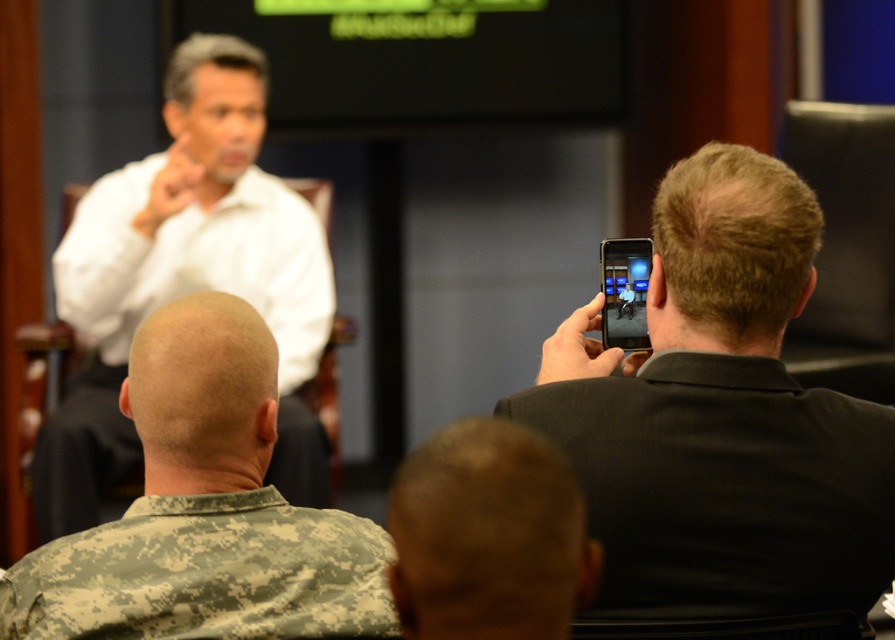
Is point (194, 538) more distant than point (483, 442)?

Yes, point (194, 538) is farther from viewer.

Is point (164, 497) positioned before point (559, 490)?

No, (164, 497) is further to viewer.

The image size is (895, 640). I want to click on camouflage fabric at lower left, so click(x=206, y=573).

From the picture: Between dark gray suit at upper right and white matte shirt at upper center, which one has less height?

With less height is dark gray suit at upper right.

Between point (820, 417) and point (229, 132), which one is positioned behind?

The point (229, 132) is behind.

Identify the location of dark gray suit at upper right. This screenshot has width=895, height=640. (720, 417).

Which of these two, camouflage uniform at lower left or camouflage uniform at lower center, stands taller?

camouflage uniform at lower left is taller.

Looking at this image, does camouflage uniform at lower left appear under camouflage uniform at lower center?

No, camouflage uniform at lower left is not below camouflage uniform at lower center.

You are a GUI agent. You are given a task and a screenshot of the screen. Output one action in this format:
    pyautogui.click(x=<x>, y=<y>)
    Task: Click on the camouflage uniform at lower left
    
    Given the screenshot: What is the action you would take?
    pyautogui.click(x=203, y=509)